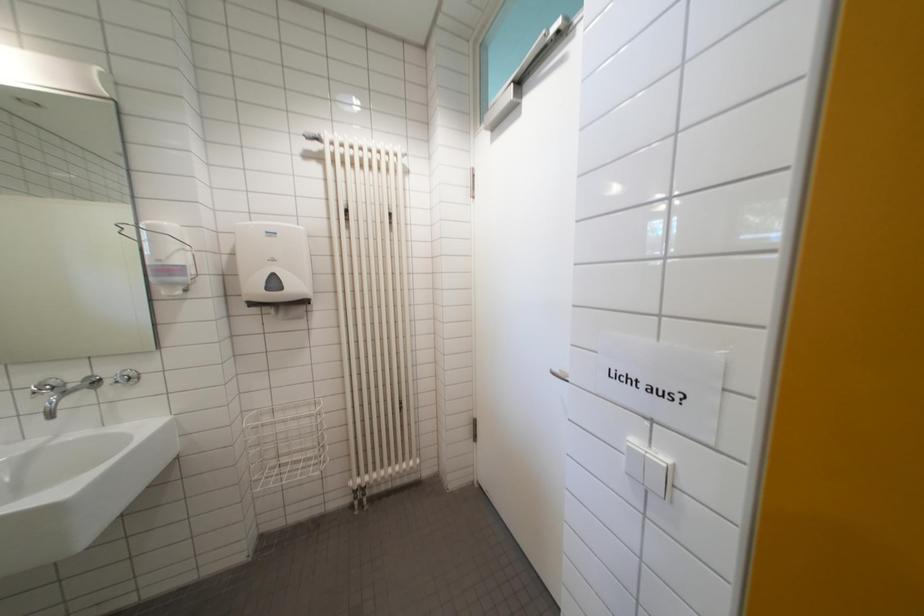
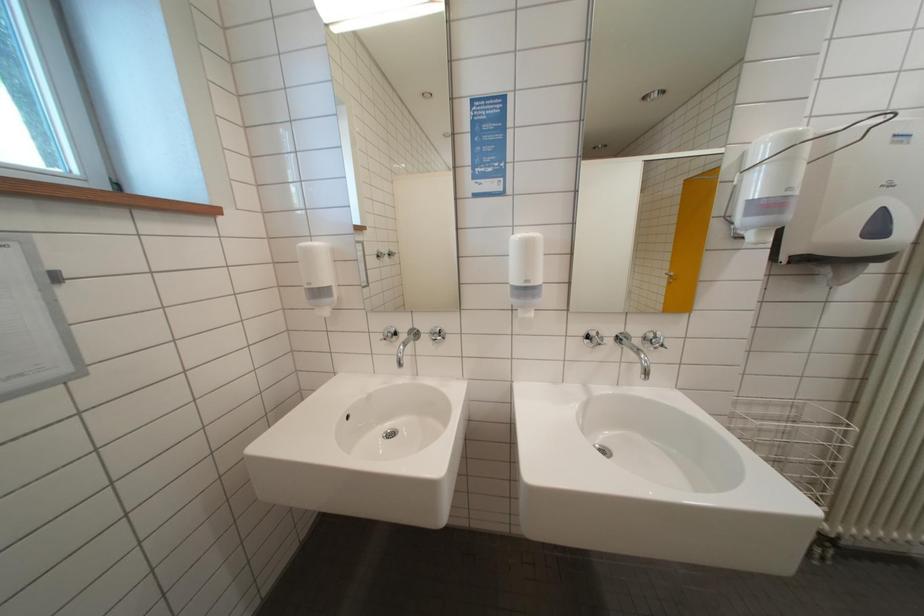
Question: Which direction would the cameraman need to move to produce the second image? Reply with the corresponding letter.

Choices:
 (A) Left
 (B) Right
 (C) Forward
 (D) Backward

Answer: (A)